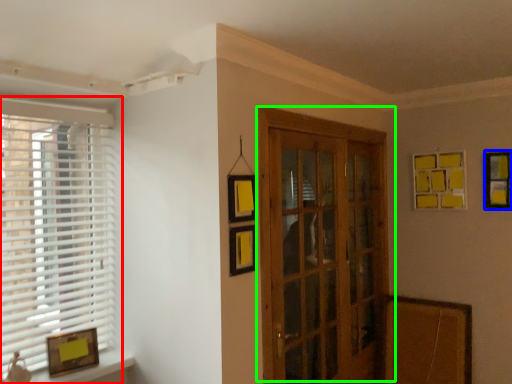
Question: Considering the real-world distances, which object is closest to window (highlighted by a red box)? picture frame (highlighted by a blue box) or door (highlighted by a green box).

Choices:
 (A) picture frame
 (B) door

Answer: (B)